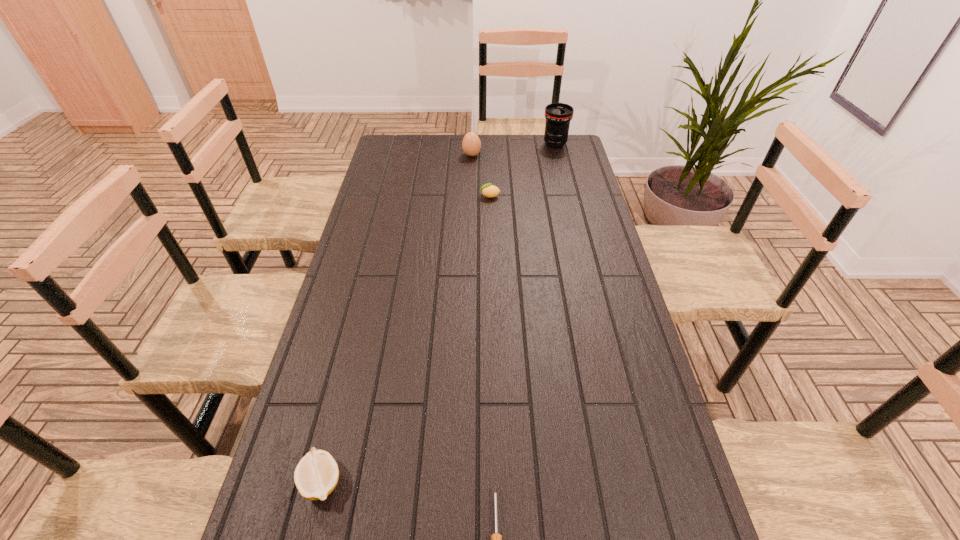
This screenshot has width=960, height=540. Identify the location of telephoto lens. (558, 115).

You are a GUI agent. You are given a task and a screenshot of the screen. Output one action in this format:
    pyautogui.click(x=<x>, y=<y>)
    Task: Click on the tallest object
    
    Given the screenshot: What is the action you would take?
    pyautogui.click(x=558, y=115)

The width and height of the screenshot is (960, 540). In order to click on boiled egg in this screenshot , I will do `click(471, 144)`.

I want to click on the farther lemon, so click(488, 190).

The image size is (960, 540). I want to click on the third nearest object, so click(x=488, y=190).

Find the location of a particular element. The width and height of the screenshot is (960, 540). the leftmost object is located at coordinates (316, 475).

Find the location of a particular element. the nearer lemon is located at coordinates (316, 475).

Where is `vacant point located 0.350m on the front of the tallest object`? The height and width of the screenshot is (540, 960). vacant point located 0.350m on the front of the tallest object is located at coordinates (568, 197).

You are a GUI agent. You are given a task and a screenshot of the screen. Output one action in this format:
    pyautogui.click(x=<x>, y=<y>)
    Task: Click on the free space located on the front of the second tallest object
    This screenshot has height=540, width=960.
    Given the screenshot: What is the action you would take?
    pyautogui.click(x=471, y=184)

Locate an element on the screen. The image size is (960, 540). vacant area situated 0.260m with leaves positioned above the farther lemon is located at coordinates (411, 196).